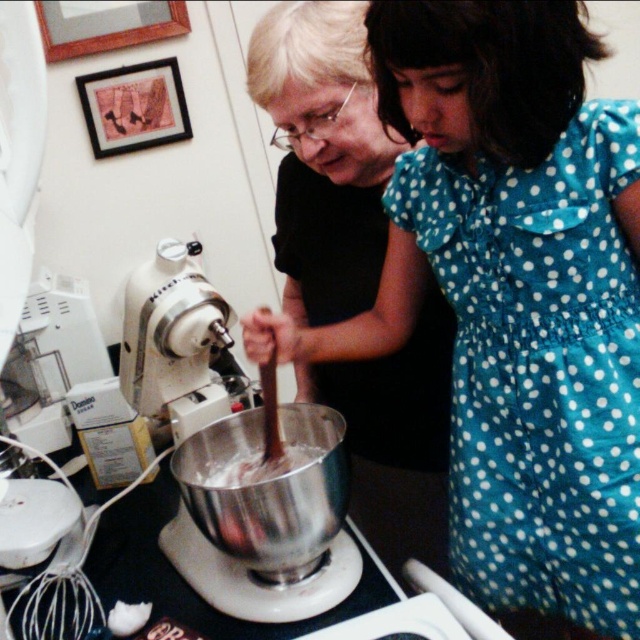
You are standing in the kitchen and need to reach the black matte stand mixer at center. Based on the coordinates provided in the Objects Description, which direction should you move to get closer to it?

The black matte stand mixer at center is located at point 0.461 on the x and 0.803 on the y. Since the coordinates are relative to the image, moving towards the center of the image would bring you closer to the mixer.

You have a kitchen tool that requires a workspace wider than the black matte stand mixer at center. Can you place it next to the smooth chocolate batter at center without moving the mixer?

The black matte stand mixer at center might be wider than the smooth chocolate batter at center, so there is a possibility that placing the tool next to the batter might not leave enough space if the mixer is wider. Check the width before placing the tool.

Based on the scene description, where is the black matte stand mixer at center located in the image?

The black matte stand mixer at center is located at the point with coordinates 0.461 and 0.803.